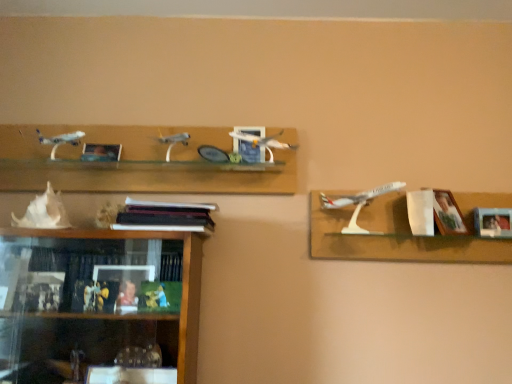
Question: In the image, is wooden photo frame at right, arranged as the 1th picture frame when viewed from the right, on the left side or the right side of matte wooden picture frame at upper center, placed as the 4th picture frame when sorted from right to left?

Choices:
 (A) right
 (B) left

Answer: (A)

Question: Is wooden photo frame at right, the fourth picture frame when ordered from left to right, taller or shorter than matte wooden picture frame at upper center, the first picture frame from the left?

Choices:
 (A) tall
 (B) short

Answer: (A)

Question: Which is nearer to the white plastic airplane at right?

Choices:
 (A) white shell at lower left
 (B) matte wooden picture frame at upper center, the first picture frame from the left
 (C) wooden picture frame at right, the 2th picture frame positioned from the right
 (D) matte blue picture frame at center, the 3th picture frame in the right-to-left sequence
 (E) black matte bookshelf at center

Answer: (C)

Question: Which object is positioned farthest from the wooden picture frame at right, the 2th picture frame positioned from the right?

Choices:
 (A) black matte bookshelf at center
 (B) matte wooden picture frame at upper center, placed as the 4th picture frame when sorted from right to left
 (C) white plastic airplane at right
 (D) white shell at lower left
 (E) wooden photo frame at right, the fourth picture frame when ordered from left to right

Answer: (D)